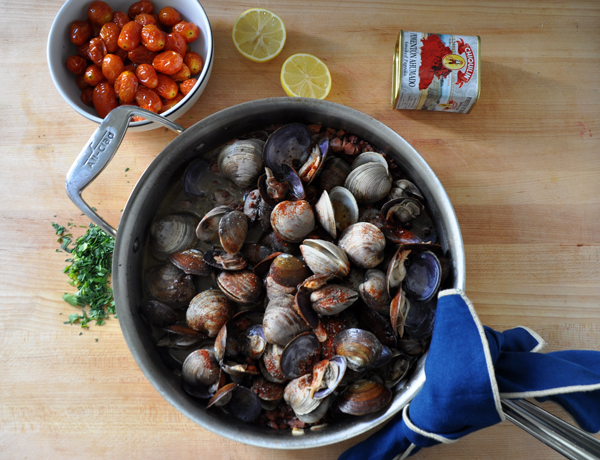
You are a GUI agent. You are given a task and a screenshot of the screen. Output one action in this format:
    pyautogui.click(x=<x>, y=<y>)
    Task: Click on the top rim of white bowl
    This screenshot has width=600, height=460.
    Given the screenshot: What is the action you would take?
    pyautogui.click(x=48, y=65)